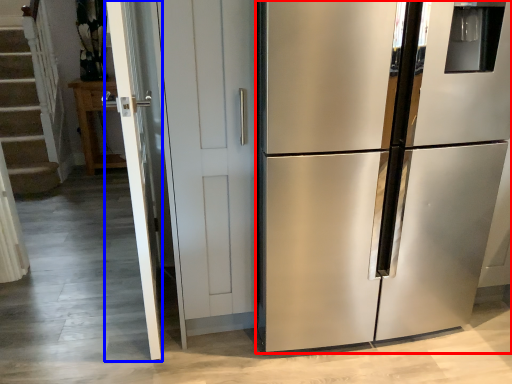
Question: Which object is further to the camera taking this photo, refrigerator (highlighted by a red box) or screen door (highlighted by a blue box)?

Choices:
 (A) refrigerator
 (B) screen door

Answer: (B)